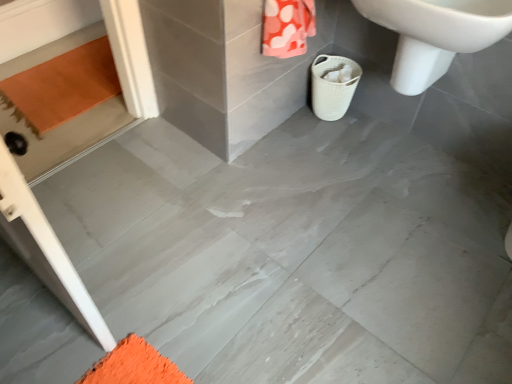
What do you see at coordinates (287, 27) in the screenshot? This screenshot has height=384, width=512. I see `polka dot fabric at upper center` at bounding box center [287, 27].

I want to click on polka dot fabric at upper center, so click(287, 27).

Identify the location of polka dot fabric at upper center. (287, 27).